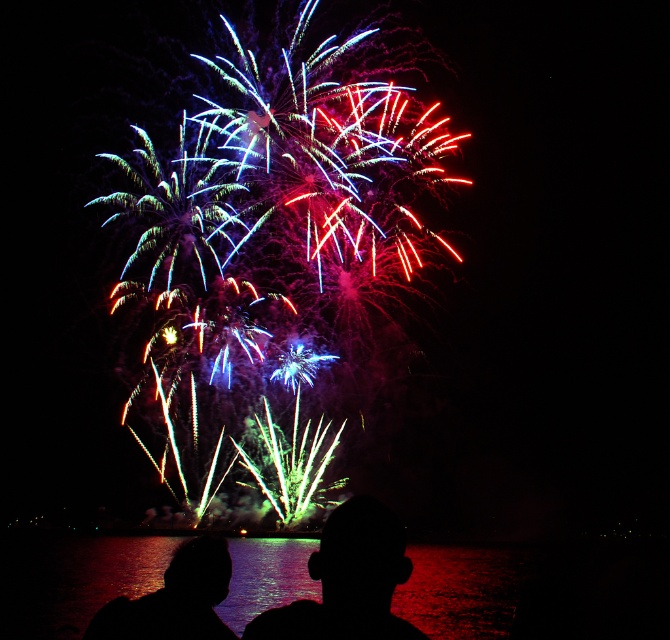
Does point (318, 564) come in front of point (210, 624)?

Yes, it is.

Who is positioned more to the left, silhouette head at center or silhouette head at lower center?

silhouette head at lower center is more to the left.

Identify the location of silhouette head at center. This screenshot has width=670, height=640. (348, 580).